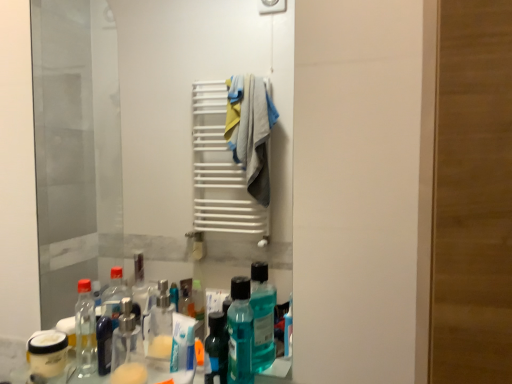
Question: Considering their positions, is transparent glass mirror at center located in front of or behind translucent plastic mouthwash at lower center?

Choices:
 (A) front
 (B) behind

Answer: (B)

Question: Based on their sizes in the image, would you say transparent glass mirror at center is bigger or smaller than translucent plastic mouthwash at lower center?

Choices:
 (A) small
 (B) big

Answer: (B)

Question: Which is correct: transparent glass mirror at center is inside translucent plastic mouthwash at lower center, or outside of it?

Choices:
 (A) inside
 (B) outside

Answer: (B)

Question: Is point (228, 339) closer or farther from the camera than point (175, 61)?

Choices:
 (A) farther
 (B) closer

Answer: (B)

Question: From the image's perspective, is translucent plastic mouthwash at lower center above or below transparent glass mirror at center?

Choices:
 (A) below
 (B) above

Answer: (A)

Question: Based on their sizes in the image, would you say translucent plastic mouthwash at lower center is bigger or smaller than transparent glass mirror at center?

Choices:
 (A) big
 (B) small

Answer: (B)

Question: In the image, is translucent plastic mouthwash at lower center positioned in front of or behind transparent glass mirror at center?

Choices:
 (A) front
 (B) behind

Answer: (A)